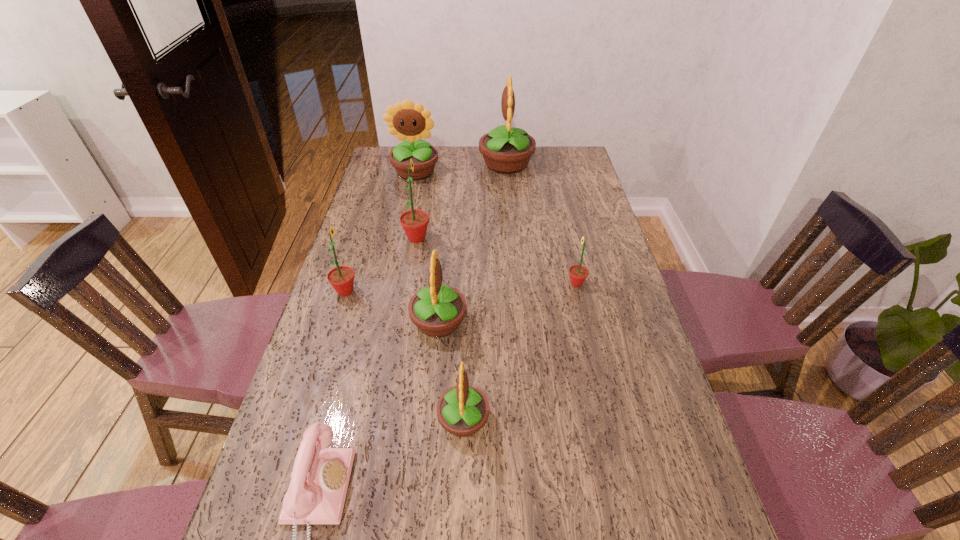
You are a GUI agent. You are given a task and a screenshot of the screen. Output one action in this format:
    pyautogui.click(x=<x>, y=<y>)
    Task: Click on the green sunflower that is the second closest to the second nearest yellow sunflower
    This screenshot has height=540, width=960.
    Given the screenshot: What is the action you would take?
    point(414,222)

Identify which green sunflower is the second closest to the second smallest green sunflower. Please provide its 2D coordinates. Your answer should be formatted as a tuple, i.e. [(x, y)], where the tuple contains the x and y coordinates of a point satisfying the conditions above.

[(578, 273)]